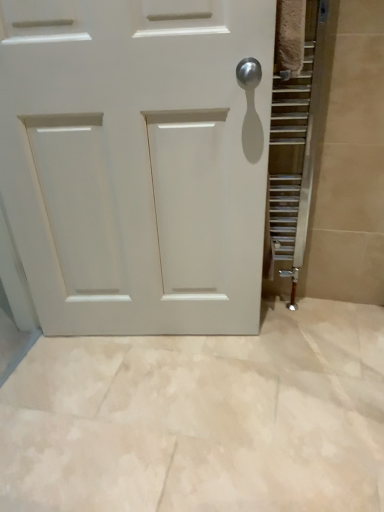
What do you see at coordinates (137, 164) in the screenshot? I see `white matte door at center` at bounding box center [137, 164].

Where is `white matte door at center`? white matte door at center is located at coordinates (137, 164).

In order to face white matte door at center, should I rotate leftwards or rightwards?

To align with it, rotate left about 7.550°.

At what (x,y) coordinates should I click in order to perform the action: click on white matte door at center. Please return your answer as a coordinate pair (x, y). The image size is (384, 512). Looking at the image, I should click on pyautogui.click(x=137, y=164).